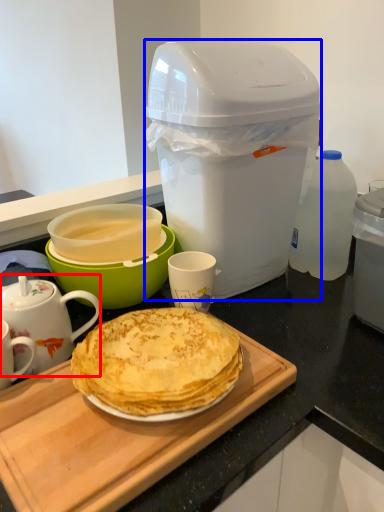
Question: Which of the following is the farthest to the observer, teapot (highlighted by a red box) or trash bin/can (highlighted by a blue box)?

Choices:
 (A) teapot
 (B) trash bin/can

Answer: (B)